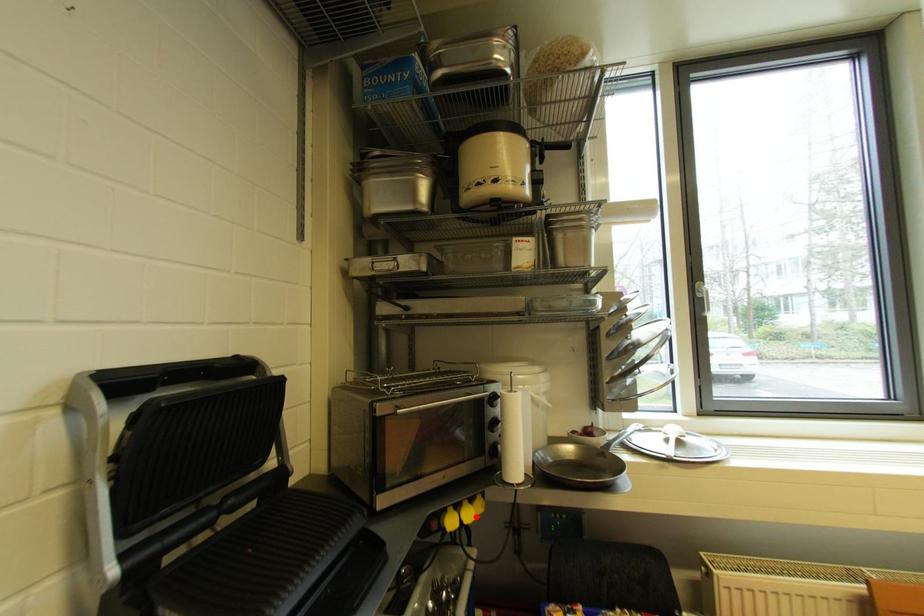
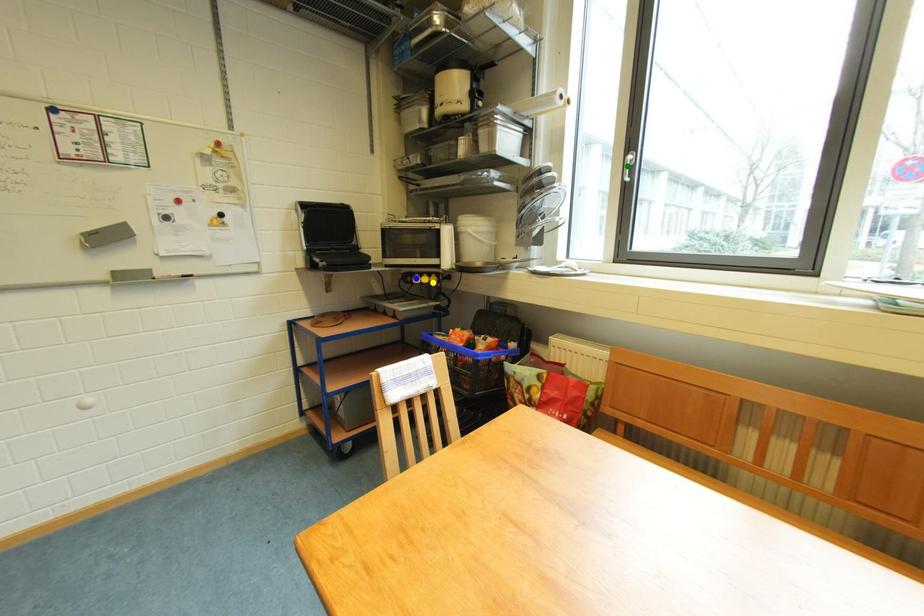
Question: I am providing you with two images of the same scene from different viewpoints. A red point is marked on the first image. You are given multiple points on the second image. Which point in image 2 represents the same 3d spot as the red point in image 1?

Choices:
 (A) blue point
 (B) yellow point
 (C) green point

Answer: (B)